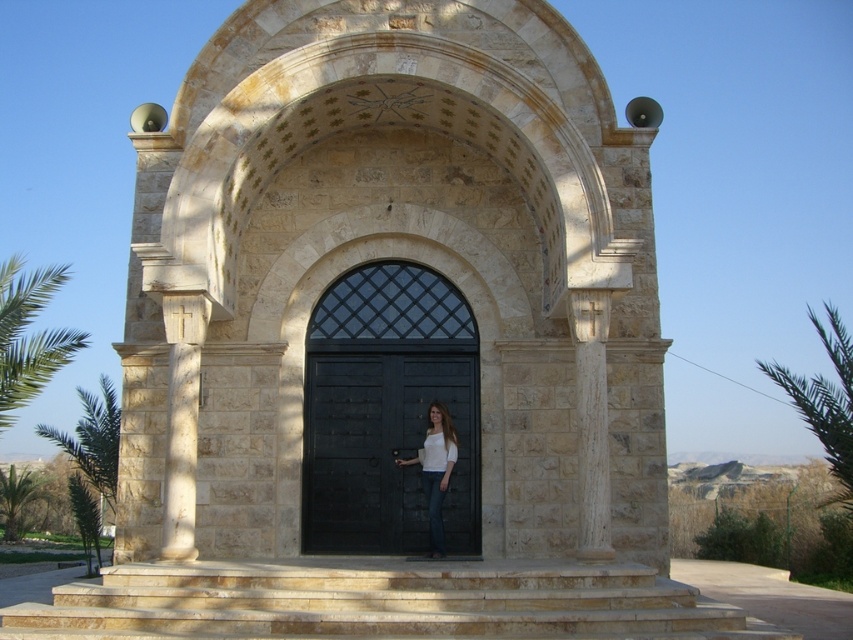
You are standing in front of the stone structure with the arched entrance. You notice a black wooden door at center and a white matte shirt at center. Which object is closer to you?

The black wooden door at center is positioned over the white matte shirt at center, so the black wooden door at center is closer to you.

You are standing in front of the chapel and want to enter through the arched entrance. Where are the beige stone stairs at center located?

The beige stone stairs at center are located at point [380,602].